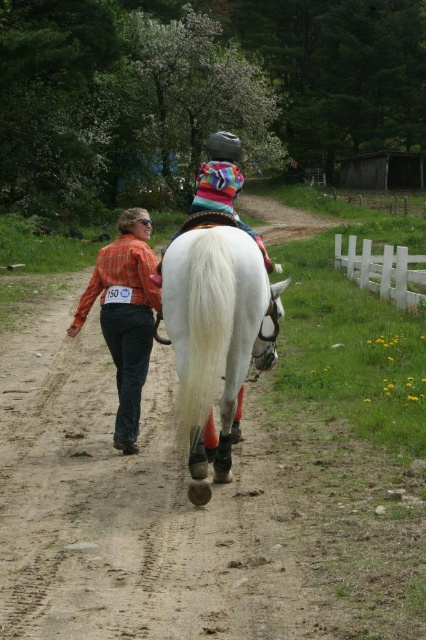
You are standing at the origin point in this rural scene. There is a point marked at coordinates (x=215, y=333). Which object is this point located on?

The point marked at coordinates (x=215, y=333) is located on the white glossy horse at center.

You are a photographer trying to capture a clear shot of both the white glossy horse at center and the orange plaid shirt at center. Based on their positions, which one should you focus on first to ensure both are in focus?

The white glossy horse at center is above the orange plaid shirt at center, so focusing on the horse first will allow the shirt to be in focus as it is lower in the frame.

You are a photographer positioned at the edge of the dirt path. You want to take a photo of the white glossy horse at center and the orange plaid shirt at center. Based on their positions, which object should you focus on first if you want to capture both in a single frame without moving the camera?

The orange plaid shirt at center is to the left of the white glossy horse at center, so you should focus on the orange plaid shirt at center first to ensure both are in frame without moving the camera.